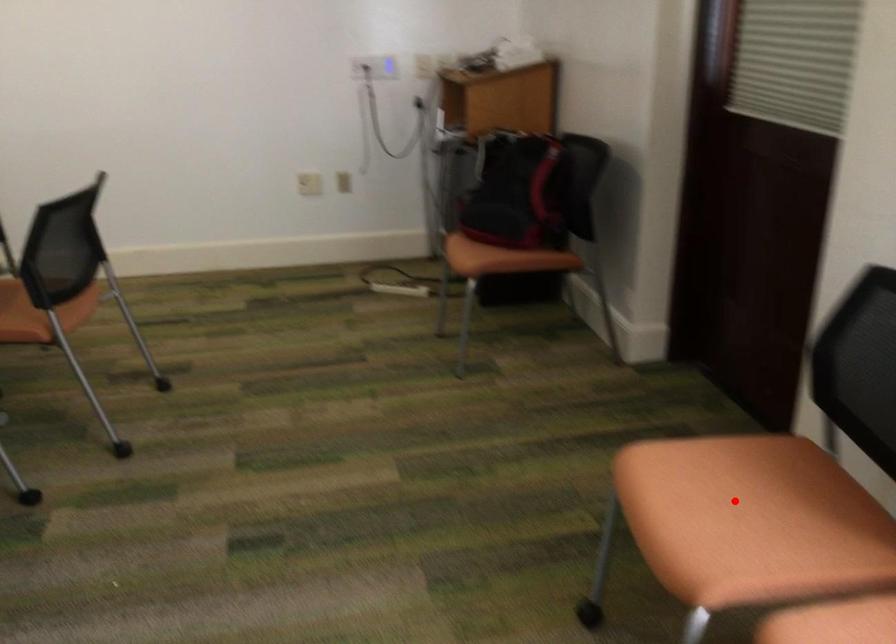
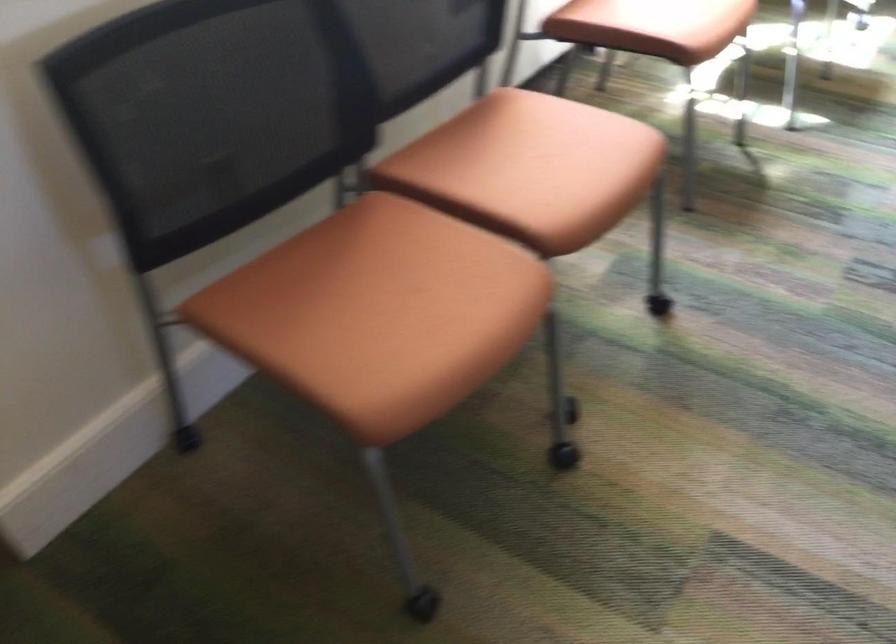
Question: I am providing you with two images of the same scene from different viewpoints. Image1 has a red point marked. In image2, the corresponding 3D location appears at what relative position? Reply with the corresponding letter.

Choices:
 (A) Closer
 (B) Farther

Answer: (A)